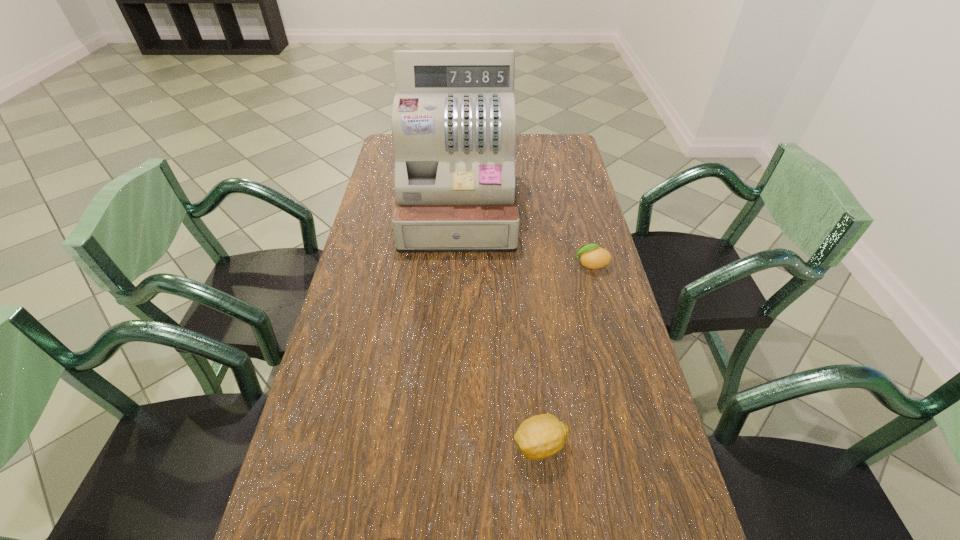
The image size is (960, 540). I want to click on free space located 0.310m with leaves positioned above the rightmost object, so click(x=468, y=265).

Where is `vacant region located 0.070m with leaves positioned above the rightmost object`? vacant region located 0.070m with leaves positioned above the rightmost object is located at coordinates (548, 265).

At what (x,y) coordinates should I click in order to perform the action: click on free space located 0.330m with leaves positioned above the rightmost object. Please return your answer as a coordinate pair (x, y). Looking at the image, I should click on coord(462,265).

The image size is (960, 540). What are the coordinates of `object located at the left edge` in the screenshot? It's located at (453, 122).

The image size is (960, 540). In order to click on object that is at the right edge in this screenshot , I will do `click(592, 256)`.

Where is `vacant space at the left edge`? The image size is (960, 540). vacant space at the left edge is located at coordinates (394, 267).

In the image, there is a desktop. Where is `vacant space at the right edge`? This screenshot has width=960, height=540. vacant space at the right edge is located at coordinates (616, 489).

Identify the location of vacant space at the far left corner. The image size is (960, 540). (391, 146).

Where is `vacant area that lies between the farthest object and the nearer lemon`? vacant area that lies between the farthest object and the nearer lemon is located at coordinates (499, 327).

At what (x,y) coordinates should I click in order to perform the action: click on vacant point located between the right lemon and the nearer lemon. Please return your answer as a coordinate pair (x, y). The image size is (960, 540). Looking at the image, I should click on (565, 355).